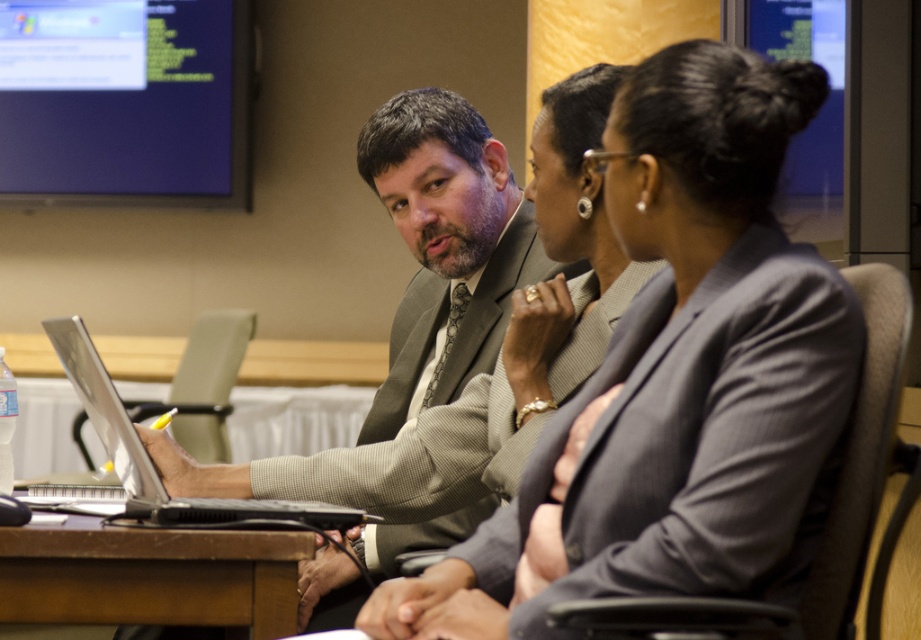
Does gray textured blazer at center have a lesser width compared to silver/black laptop at left?

Correct, gray textured blazer at center's width is less than silver/black laptop at left's.

Who is positioned more to the right, gray textured blazer at center or silver/black laptop at left?

From the viewer's perspective, gray textured blazer at center appears more on the right side.

Between point (618, 392) and point (91, 404), which one is positioned in front?

Point (618, 392) is in front.

At what (x,y) coordinates should I click in order to perform the action: click on gray textured blazer at center. Please return your answer as a coordinate pair (x, y). This screenshot has height=640, width=921. Looking at the image, I should click on (697, 440).

Is gray suit at center to the left of brown wooden table at lower left from the viewer's perspective?

No, gray suit at center is not to the left of brown wooden table at lower left.

Which is in front, point (331, 593) or point (289, 545)?

Positioned in front is point (289, 545).

Where is `gray suit at center`? The width and height of the screenshot is (921, 640). gray suit at center is located at coordinates (446, 248).

The height and width of the screenshot is (640, 921). I want to click on gray suit at center, so pos(446,248).

Who is positioned more to the left, gray suit at center or silver/black laptop at left?

Positioned to the left is silver/black laptop at left.

Is gray suit at center positioned before silver/black laptop at left?

No, it is behind silver/black laptop at left.

Identify the location of gray suit at center. This screenshot has height=640, width=921. (446, 248).